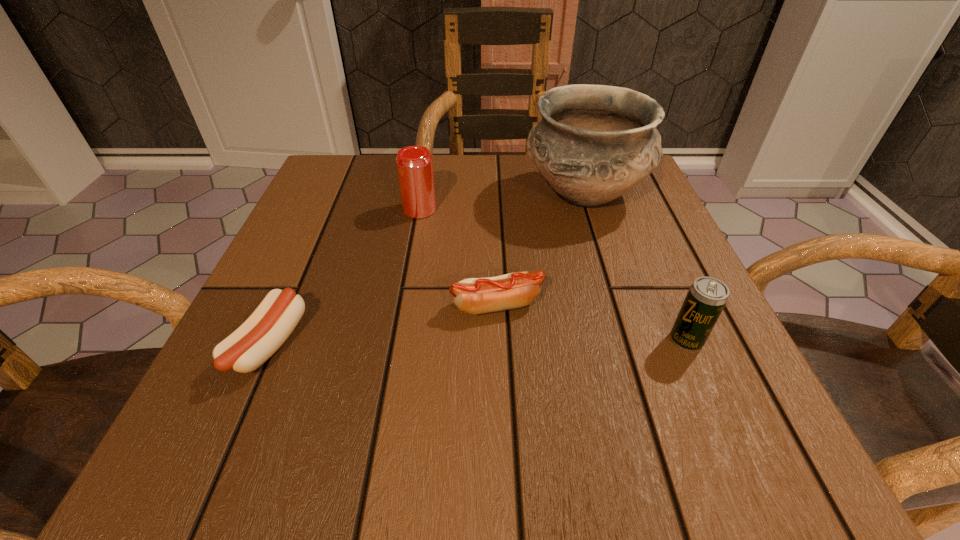
What are the coordinates of `the tallest object` in the screenshot? It's located at (594, 143).

Identify the location of the farther beer can. The width and height of the screenshot is (960, 540). (414, 163).

This screenshot has height=540, width=960. I want to click on the left beer can, so click(x=414, y=163).

Where is `the right beer can`? Image resolution: width=960 pixels, height=540 pixels. the right beer can is located at coordinates (706, 298).

The image size is (960, 540). In order to click on the nearer beer can in this screenshot , I will do (x=706, y=298).

The image size is (960, 540). Identify the location of the right sausage. (475, 296).

Where is `the leftmost object`? The height and width of the screenshot is (540, 960). the leftmost object is located at coordinates (268, 327).

Locate an element on the screen. The height and width of the screenshot is (540, 960). vacant point located on the front of the tallest object is located at coordinates (623, 315).

At what (x,y) coordinates should I click in order to perform the action: click on vacant space located on the back of the farther beer can. Please return your answer as a coordinate pair (x, y). Looking at the image, I should click on (428, 159).

I want to click on vacant space located 0.250m on the left of the third tallest object, so click(x=503, y=340).